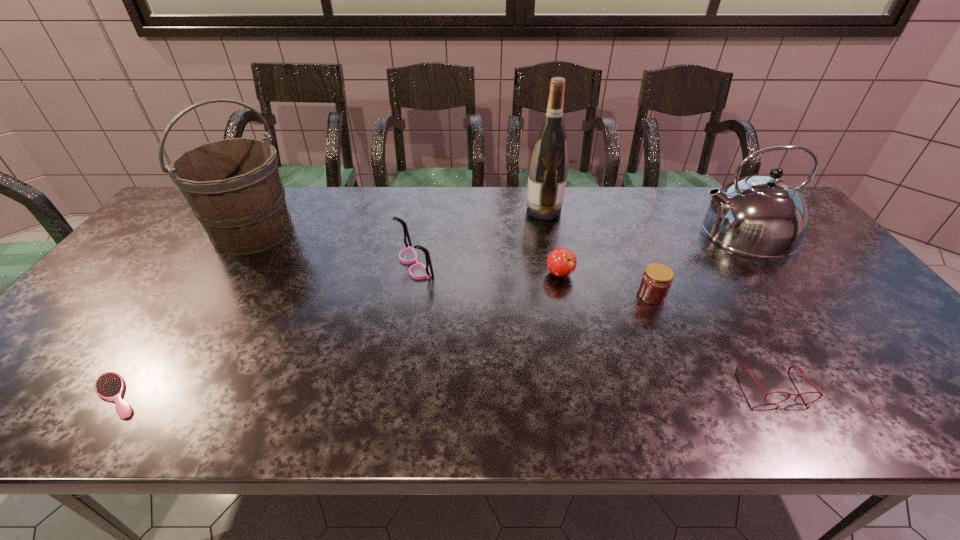
Find the location of a particular element. This screenshot has width=960, height=540. vacant space situated 0.400m on the right of the apple is located at coordinates (720, 274).

Image resolution: width=960 pixels, height=540 pixels. What are the coordinates of `blank space located 0.080m on the left of the shortest object` in the screenshot? It's located at (49, 395).

I want to click on wine bottle located at the far edge, so click(x=548, y=167).

Locate an element on the screen. Image resolution: width=960 pixels, height=540 pixels. bucket that is at the far edge is located at coordinates (233, 186).

This screenshot has height=540, width=960. What are the coordinates of `kettle that is at the far edge` in the screenshot? It's located at (763, 216).

In order to click on spectacles that is at the near edge in this screenshot , I will do `click(801, 371)`.

Locate an element on the screen. hairbrush present at the near edge is located at coordinates (110, 386).

Where is `object present at the right edge`? object present at the right edge is located at coordinates (763, 216).

This screenshot has width=960, height=540. Find the location of `object located in the far right corner section of the desktop`. object located in the far right corner section of the desktop is located at coordinates (763, 216).

The width and height of the screenshot is (960, 540). In order to click on vacant position at the far edge of the desktop in this screenshot , I will do `click(517, 200)`.